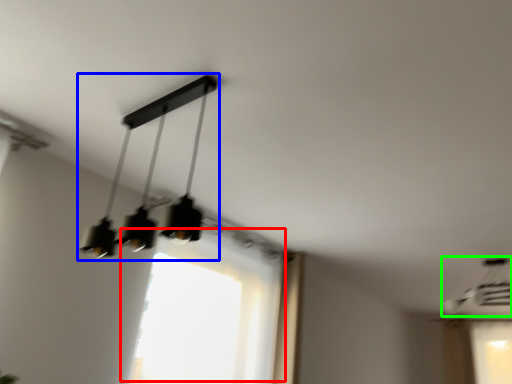
Question: Which object is positioned farthest from window (highlighted by a red box)? Select from lamp (highlighted by a blue box) and lamp (highlighted by a green box).

Choices:
 (A) lamp
 (B) lamp

Answer: (B)